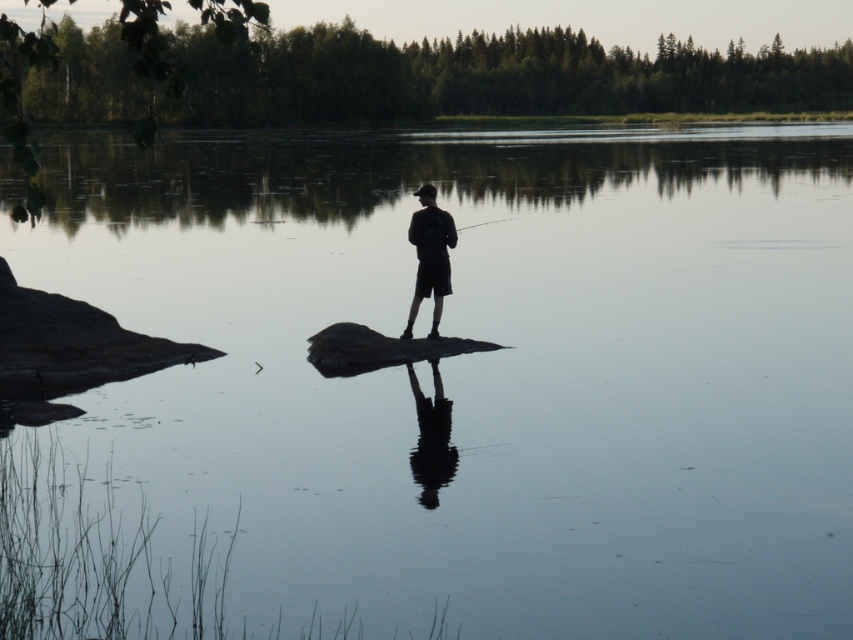
Question: Does black matte shorts at center appear over smooth black rod at center?

Choices:
 (A) yes
 (B) no

Answer: (B)

Question: Which of the following is the farthest from the observer?

Choices:
 (A) (469, 225)
 (B) (442, 250)

Answer: (A)

Question: Does black matte shorts at center lie in front of smooth black rod at center?

Choices:
 (A) no
 (B) yes

Answer: (B)

Question: Which point is farther to the camera?

Choices:
 (A) smooth black rod at center
 (B) black matte shorts at center

Answer: (A)

Question: Which object appears farthest from the camera in this image?

Choices:
 (A) smooth black rod at center
 (B) black matte shorts at center

Answer: (A)

Question: Can you confirm if black matte shorts at center is thinner than smooth black rod at center?

Choices:
 (A) yes
 (B) no

Answer: (A)